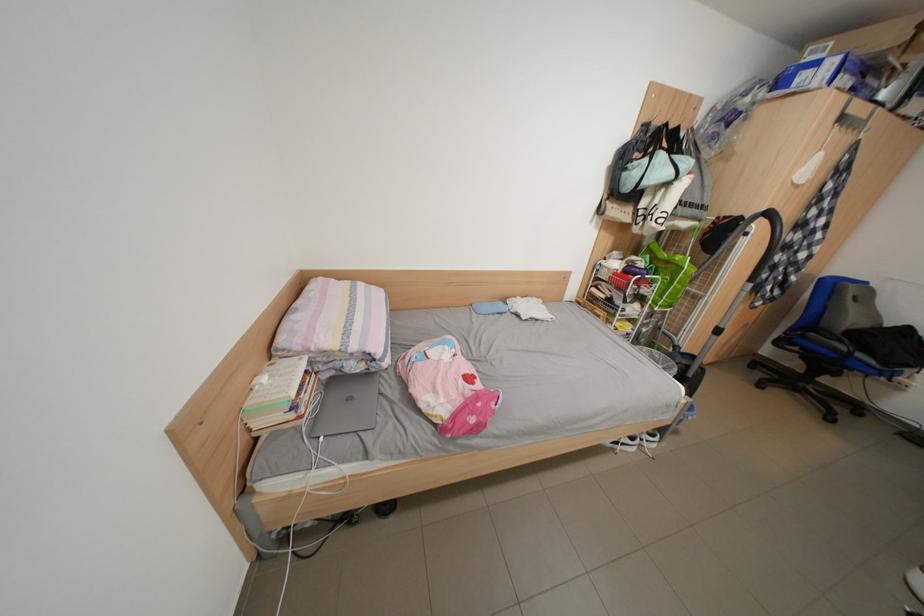
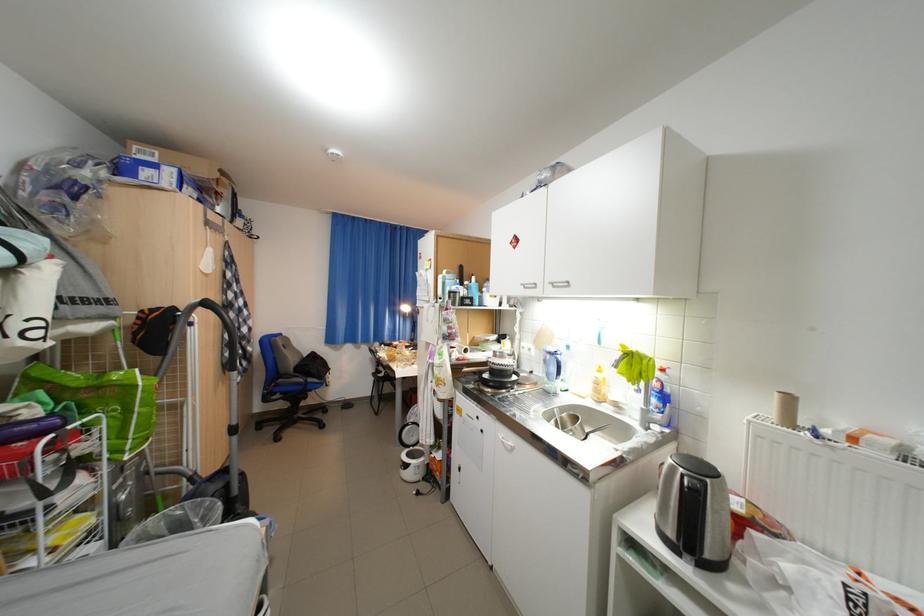
Where in the second image is the point corresponding to point (781, 215) from the first image?

(217, 305)